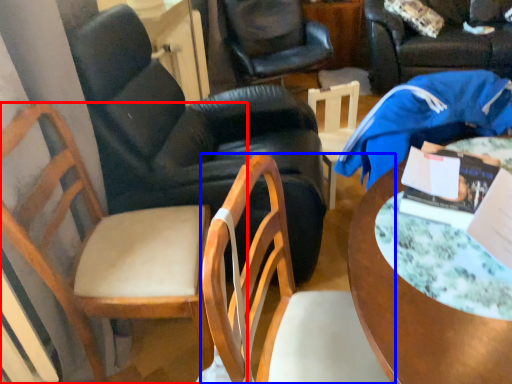
Question: Which object is closer to the camera taking this photo, chair (highlighted by a red box) or chair (highlighted by a blue box)?

Choices:
 (A) chair
 (B) chair

Answer: (B)